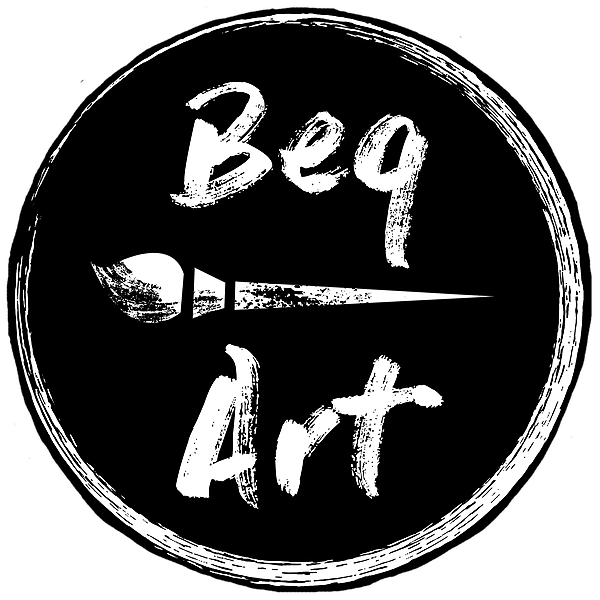
Find the location of a particular element. Image resolution: width=600 pixels, height=600 pixels. illustration of brush end of paintbrush is located at coordinates (153, 280).